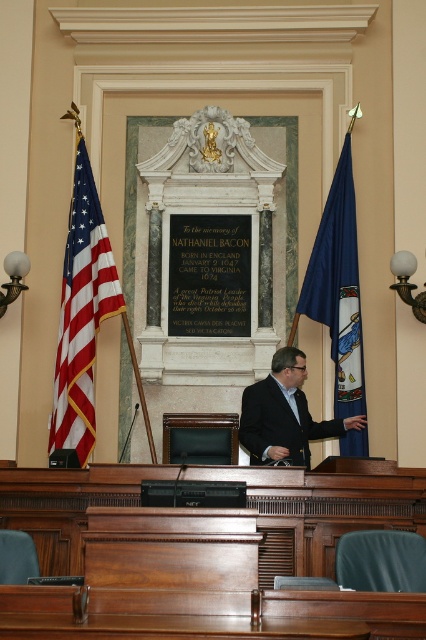
Can you confirm if american flag at left is taller than dark suit at center?

Incorrect, american flag at left's height is not larger of dark suit at center's.

The height and width of the screenshot is (640, 426). I want to click on american flag at left, so click(81, 310).

Who is more distant from viewer, (86,244) or (252,390)?

The point (86,244) is behind.

Image resolution: width=426 pixels, height=640 pixels. In order to click on american flag at left in this screenshot , I will do `click(81, 310)`.

Is blue fabric flag at right below dark suit at center?

Indeed, blue fabric flag at right is positioned under dark suit at center.

Does blue fabric flag at right have a lesser height compared to dark suit at center?

Indeed, blue fabric flag at right has a lesser height compared to dark suit at center.

Is point (336, 240) farther from viewer compared to point (313, 429)?

Yes, it is.

Locate an element on the screen. This screenshot has width=426, height=640. blue fabric flag at right is located at coordinates (337, 288).

What do you see at coordinates (81, 310) in the screenshot? Image resolution: width=426 pixels, height=640 pixels. I see `american flag at left` at bounding box center [81, 310].

Is point (81, 416) behind point (322, 280)?

No, it is in front of (322, 280).

Who is more distant from viewer, (75, 440) or (331, 232)?

Positioned behind is point (331, 232).

This screenshot has height=640, width=426. In order to click on american flag at left in this screenshot , I will do `click(81, 310)`.